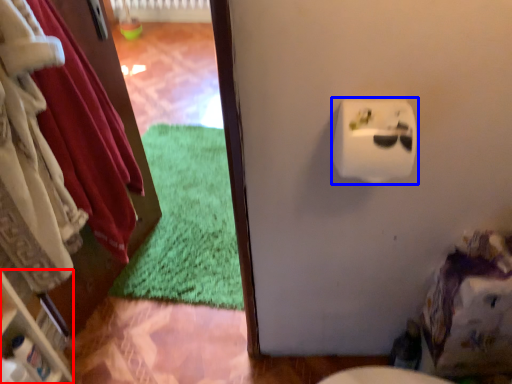
Question: Which object appears closest to the camera in this image, shelf (highlighted by a red box) or toilet paper (highlighted by a blue box)?

Choices:
 (A) shelf
 (B) toilet paper

Answer: (B)